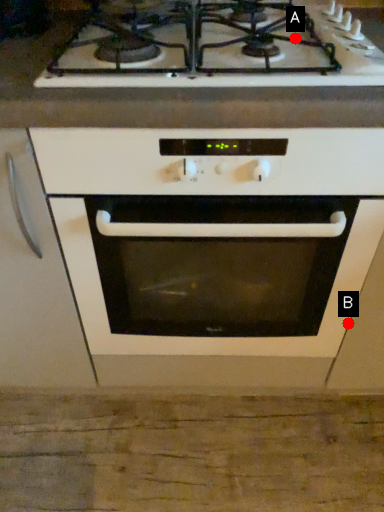
Question: Two points are circled on the image, labeled by A and B beside each circle. Which of the following is the farthest from the observer?

Choices:
 (A) A is further
 (B) B is further

Answer: (B)